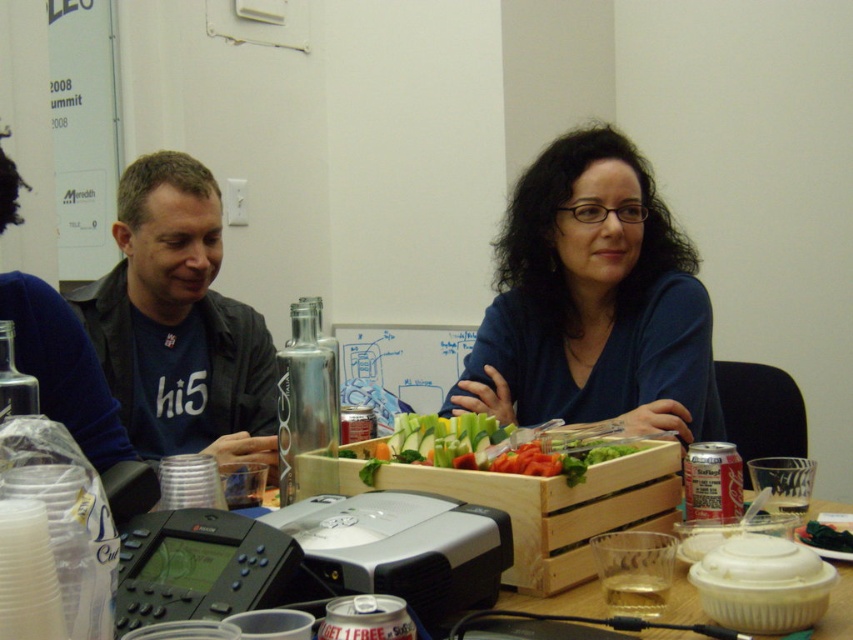
Question: Is blue matte shirt at center positioned before fresh green vegetables at center?

Choices:
 (A) yes
 (B) no

Answer: (B)

Question: Is the position of blue matte shirt at center more distant than that of matte black jacket at left?

Choices:
 (A) no
 (B) yes

Answer: (A)

Question: Which point is closer to the camera taking this photo?

Choices:
 (A) (624, 193)
 (B) (552, 586)
 (C) (219, 224)
 (D) (473, 444)

Answer: (B)

Question: Which of the following is the closest to the observer?

Choices:
 (A) (590, 566)
 (B) (258, 352)
 (C) (704, 371)
 (D) (426, 433)

Answer: (A)

Question: Which object appears farthest from the camera in this image?

Choices:
 (A) wooden crate at center
 (B) blue matte shirt at center
 (C) fresh green vegetables at center
 (D) matte black jacket at left

Answer: (D)

Question: Can you confirm if wooden crate at center is positioned above fresh green vegetables at center?

Choices:
 (A) no
 (B) yes

Answer: (A)